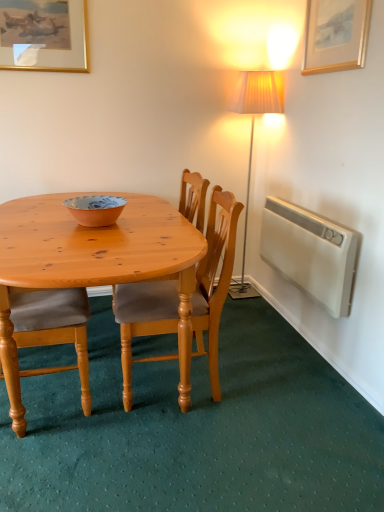
Question: Does point (57, 248) appear closer or farther from the camera than point (198, 266)?

Choices:
 (A) farther
 (B) closer

Answer: (B)

Question: Is wooden chair at left, the 1th chair positioned from the left, spatially inside light brown wood chair at center, the 2th chair positioned from the left, or outside of it?

Choices:
 (A) inside
 (B) outside

Answer: (B)

Question: Estimate the real-world distances between objects in this image. Which object is farther from the matte orange bowl at center?

Choices:
 (A) gold-framed picture at upper left, positioned as the 1th picture frame in back-to-front order
 (B) wooden picture frame at upper right, marked as the first picture frame in a right-to-left arrangement
 (C) wooden chair at left, the 1th chair positioned from the left
 (D) white plastic radiator at right
 (E) light brown wood chair at center, the first chair in the right-to-left sequence

Answer: (B)

Question: Which object is positioned farthest from the wooden picture frame at upper right, which is the 2th picture frame from back to front?

Choices:
 (A) wooden chair at left, the 1th chair positioned from the left
 (B) gold-framed picture at upper left, the second picture frame when ordered from front to back
 (C) matte orange bowl at center
 (D) white plastic radiator at right
 (E) light brown wood chair at center, the first chair in the right-to-left sequence

Answer: (A)